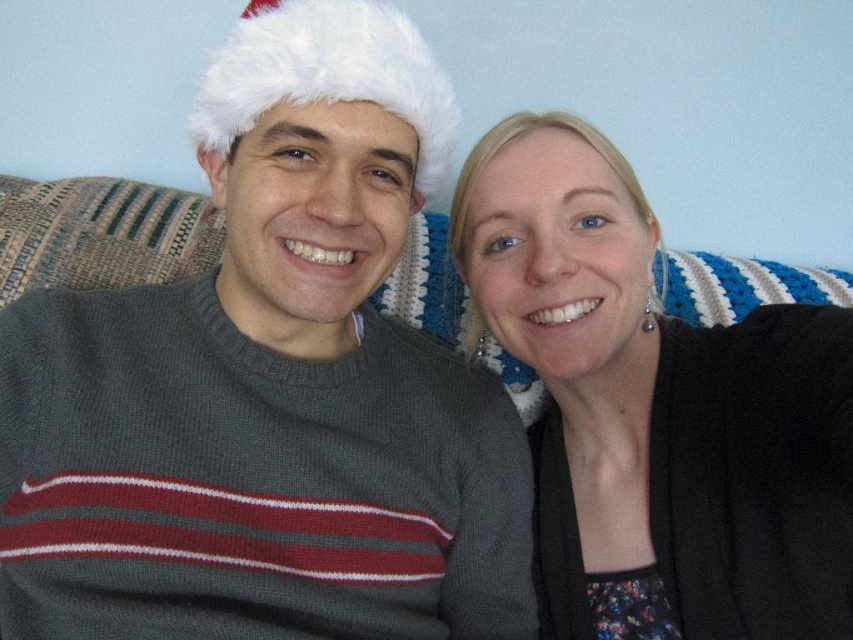
You are a fashion designer trying to create a layered outfit using the knit gray sweater at center and the black matte sweater at right. Since you want the layered look to have a balanced appearance, which sweater should you place on top to ensure the total height doesn t become too bulky?

The knit gray sweater at center is taller than the black matte sweater at right, so placing the black matte sweater at right on top would help maintain a balanced layered look without adding excessive bulk.

From the picture: You are taking a photo of two people sitting on a couch. You notice two points in the image at coordinates point (740, 518) and point (212, 83). Which point is closer to the camera?

Point (740, 518) is further to the camera than point (212, 83), so the closer point to the camera is point (212, 83).

You are a photographer trying to focus on the black matte sweater at right and the white fluffy hat at upper center. Which object is closer to the camera?

The black matte sweater at right is closer to the camera because it is in front of the white fluffy hat at upper center.